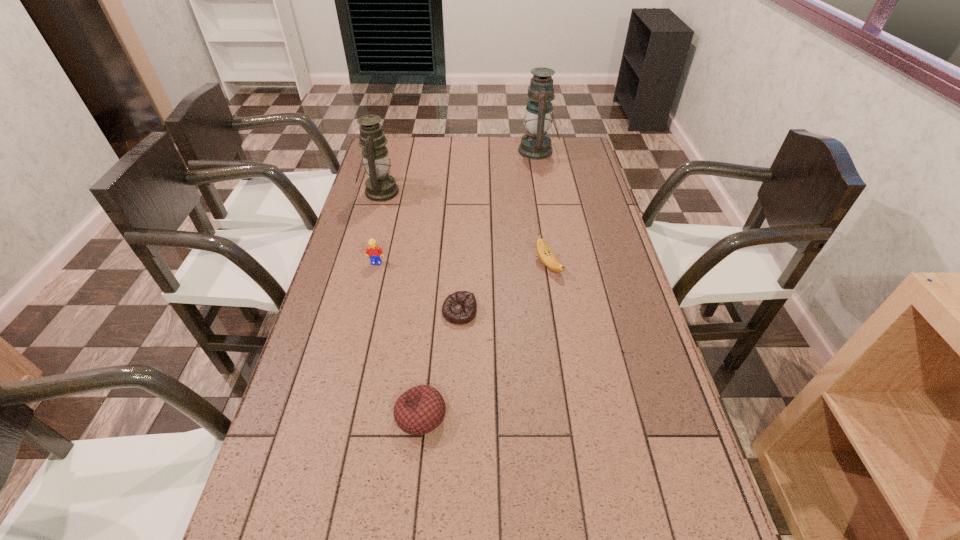
This screenshot has width=960, height=540. Identify the location of vacant point located between the farther oil lamp and the banana. (543, 208).

This screenshot has height=540, width=960. I want to click on vacant point located between the shorter oil lamp and the fifth farthest object, so 420,252.

Identify which object is located as the third nearest to the shorter beanbag. Please provide its 2D coordinates. Your answer should be formatted as a tuple, i.e. [(x, y)], where the tuple contains the x and y coordinates of a point satisfying the conditions above.

[(374, 252)]

Locate an element on the screen. This screenshot has width=960, height=540. the third closest object to the Lego is located at coordinates (419, 410).

Find the location of a particular element. The height and width of the screenshot is (540, 960). the second closest beanbag relative to the Lego is located at coordinates (419, 410).

Find the location of a particular element. The image size is (960, 540). vacant space that satisfies the following two spatial constraints: 1. on the front-facing side of the Lego; 2. on the left side of the banana is located at coordinates (376, 265).